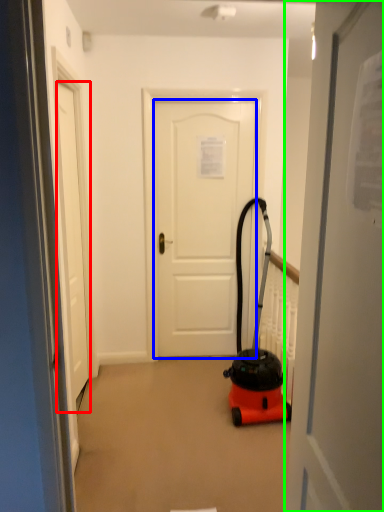
Question: Considering the real-world distances, which object is farthest from door (highlighted by a red box)? door (highlighted by a blue box) or door (highlighted by a green box)?

Choices:
 (A) door
 (B) door

Answer: (B)